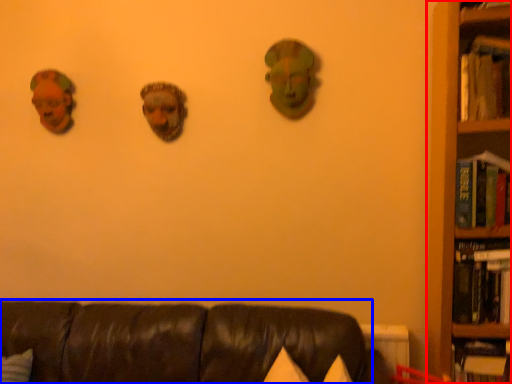
Question: Which of the following is the farthest to the observer, bookcase (highlighted by a red box) or studio couch (highlighted by a blue box)?

Choices:
 (A) bookcase
 (B) studio couch

Answer: (A)